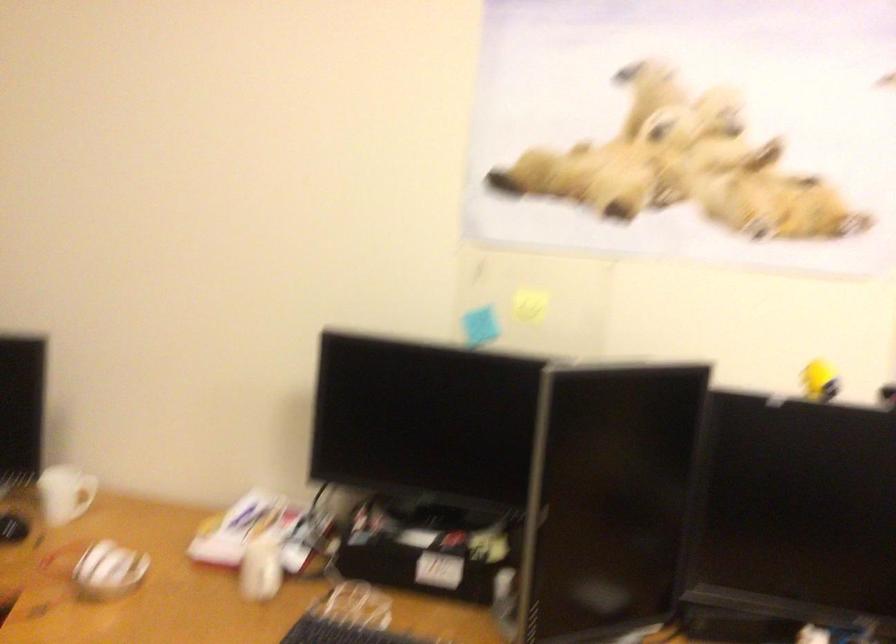
Find where to grasp the white mug handle. Please return your answer as a coordinate pair (x, y).

(83, 495)